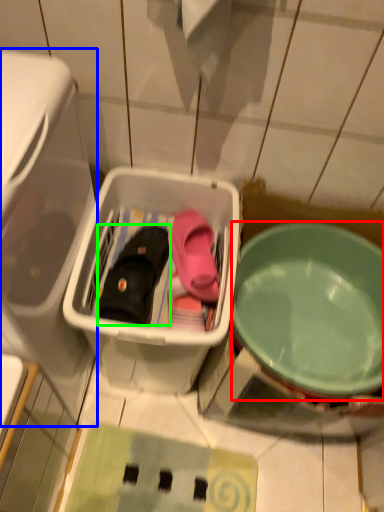
Question: Considering the real-world distances, which object is farthest from bowl (highlighted by a red box)? dish washer (highlighted by a blue box) or footwear (highlighted by a green box)?

Choices:
 (A) dish washer
 (B) footwear

Answer: (A)